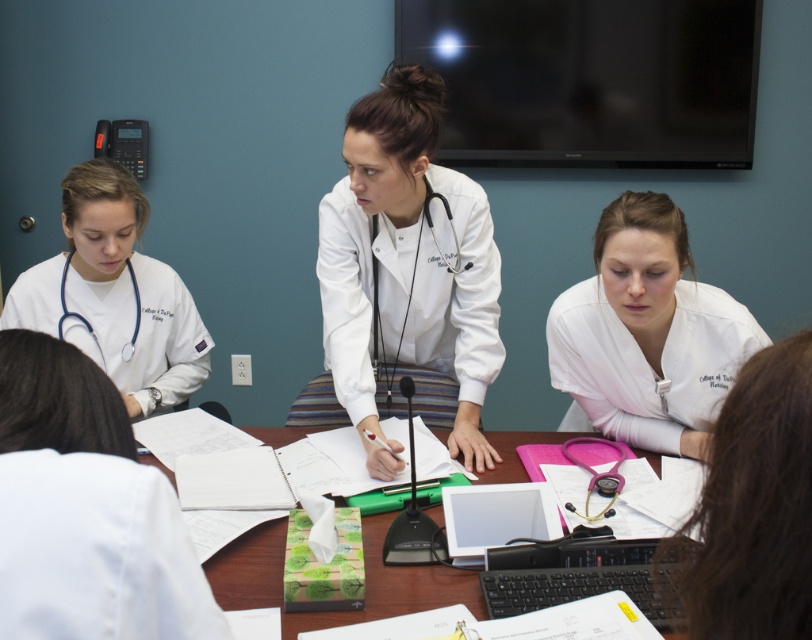
Question: Which point appears closest to the camera in this image?

Choices:
 (A) (387, 84)
 (B) (793, 440)
 (C) (372, 515)
 (D) (408, 300)

Answer: (B)

Question: Is white matte uniform at lower right below white smooth stethoscope at lower right?

Choices:
 (A) yes
 (B) no

Answer: (B)

Question: Estimate the real-world distances between objects in this image. Which object is closer to the wooden table at center?

Choices:
 (A) white smooth stethoscope at lower right
 (B) white fabric stethoscope at center
 (C) white matte uniform at lower right

Answer: (C)

Question: Does white matte stethoscope at left have a larger size compared to matte black stethoscope at lower left?

Choices:
 (A) yes
 (B) no

Answer: (A)

Question: Which point is closer to the camera?

Choices:
 (A) (117, 300)
 (B) (378, 339)
 (C) (59, 280)

Answer: (C)

Question: Observing the image, what is the correct spatial positioning of white smooth stethoscope at lower right in reference to matte black stethoscope at lower left?

Choices:
 (A) below
 (B) above

Answer: (A)